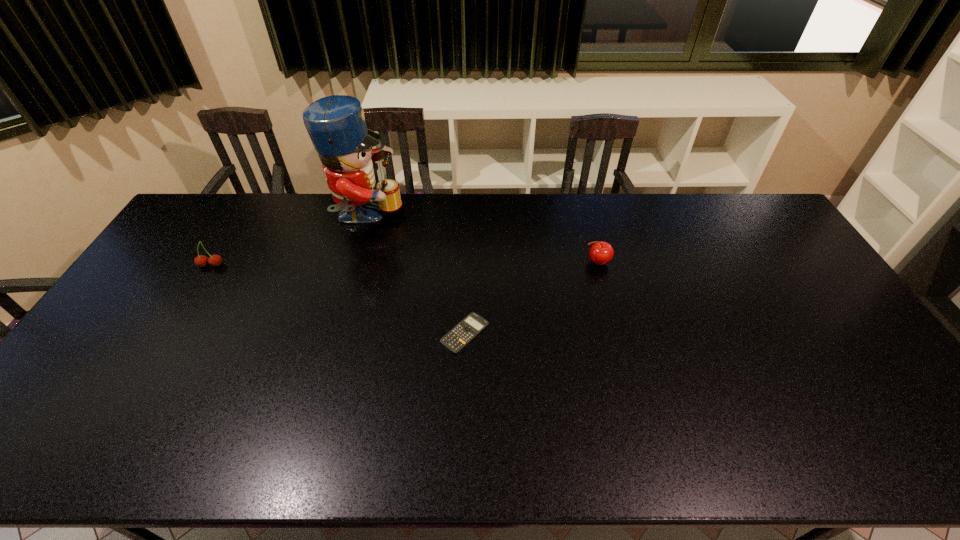
You are a GUI agent. You are given a task and a screenshot of the screen. Output one action in this format:
    pyautogui.click(x=<x>, y=<y>)
    Task: Click on the free space between the right cherry and the leftmost object
    
    Given the screenshot: What is the action you would take?
    pyautogui.click(x=404, y=264)

At what (x,y) coordinates should I click in order to perform the action: click on unoccupied position between the left cherry and the nearest object. Please return your answer as a coordinate pair (x, y). The width and height of the screenshot is (960, 540). Looking at the image, I should click on point(338,299).

This screenshot has height=540, width=960. Identify the location of free space between the left cherry and the shortest object. (338, 299).

Image resolution: width=960 pixels, height=540 pixels. Find the location of `vacant point located between the calculator and the tallest object`. vacant point located between the calculator and the tallest object is located at coordinates (416, 275).

What are the coordinates of `unoccupied position between the left cherry and the third object from left to right` in the screenshot? It's located at (338, 299).

Where is `free space between the leftmost object and the shortest object`? The image size is (960, 540). free space between the leftmost object and the shortest object is located at coordinates (338, 299).

Locate an element on the screen. free space that is in between the rightmost object and the left cherry is located at coordinates [x=404, y=264].

Find the location of a particular element. Image resolution: width=960 pixels, height=540 pixels. unoccupied area between the tallest object and the calculator is located at coordinates (416, 275).

At what (x,y) coordinates should I click in order to perform the action: click on the second closest object relative to the nutcracker. Please return your answer as a coordinate pair (x, y). Looking at the image, I should click on (457, 338).

Identify the location of the second closest object to the left cherry. (457, 338).